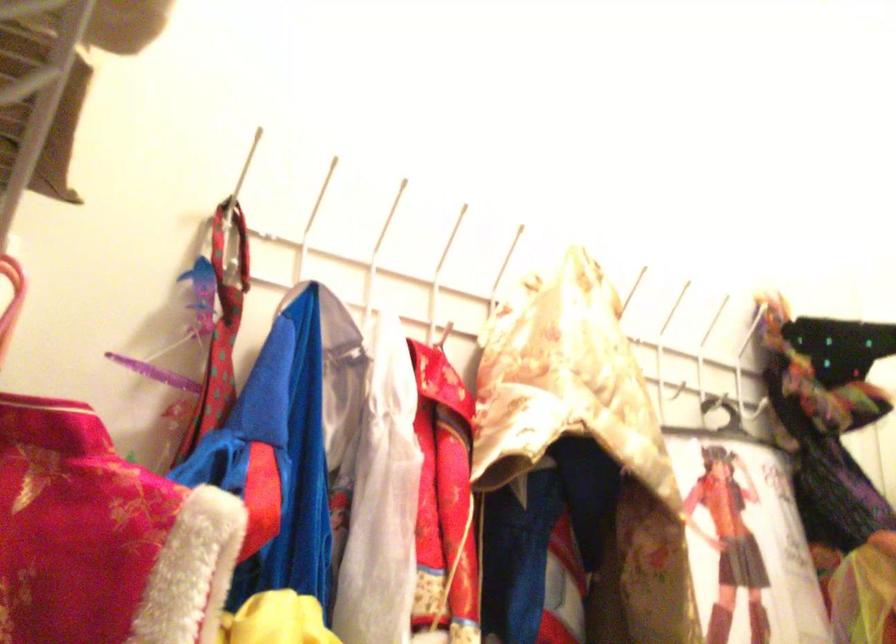
Find where to hang the pink hanger hook. Please return your answer as a coordinate pair (x, y).

(11, 299)